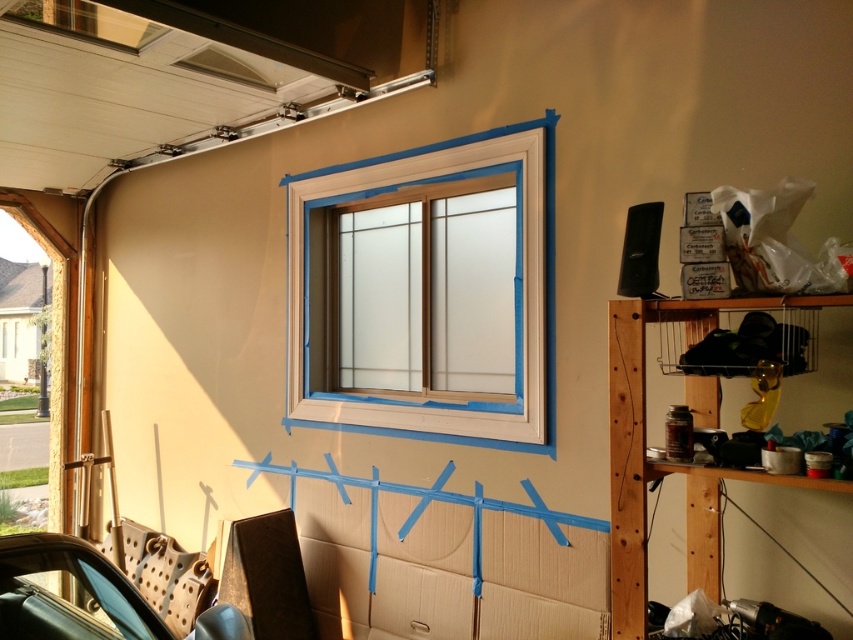
You are a painter working in the garage. You need to know which object is taller between the beige wood window frame at center and the teal leather car seat at lower left. Can you tell me?

The beige wood window frame at center is taller than the teal leather car seat at lower left.

You are a painter working in the garage and need to reach the beige wood window frame at center to remove the painter tape. You have a ladder that can reach up to 2 meters. The teal leather car seat at lower left is blocking your path. Can you safely access the window frame without moving the car seat?

The beige wood window frame at center is located above the teal leather car seat at lower left. Since the car seat is blocking the path, you would need to move it to safely access the window frame. However, if the ladder can reach 2 meters and the window frame is within that height, you might be able to access it from the side, but the car seat still poses an obstruction. It is recommended to move the car seat for safe access.

Please provide the 2D coordinates of the beige wood window frame at center in the garage scene.

The beige wood window frame at center is located at coordinates (x=332, y=298).